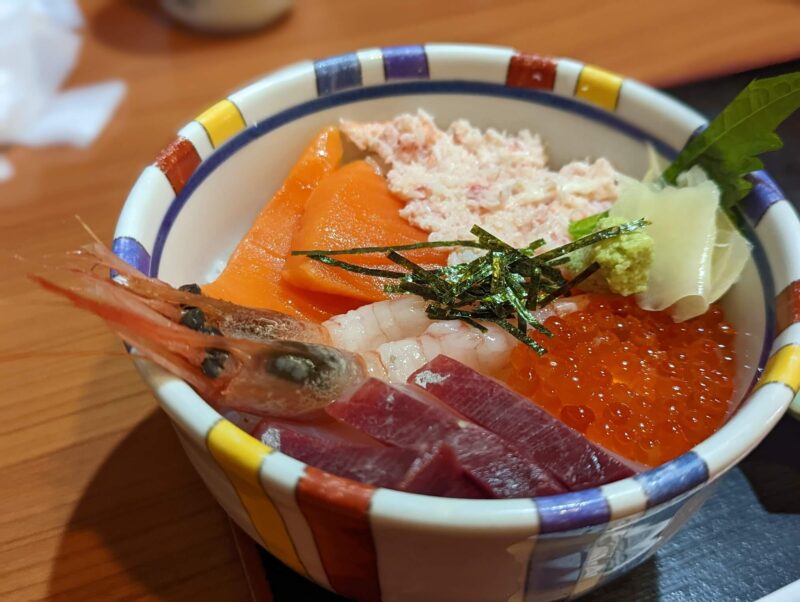
The height and width of the screenshot is (602, 800). In order to click on open brown table area, top of image in this screenshot , I will do `click(714, 38)`, `click(641, 37)`, `click(326, 45)`, `click(153, 85)`.